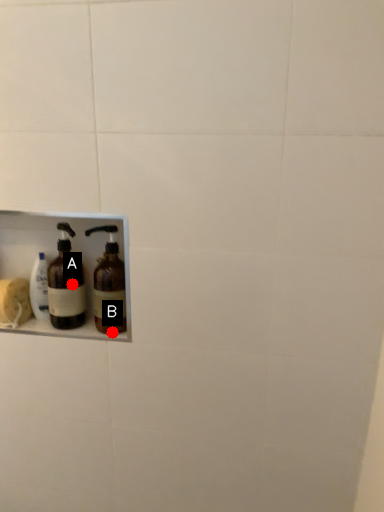
Question: Two points are circled on the image, labeled by A and B beside each circle. Which point appears farthest from the camera in this image?

Choices:
 (A) A is further
 (B) B is further

Answer: (B)